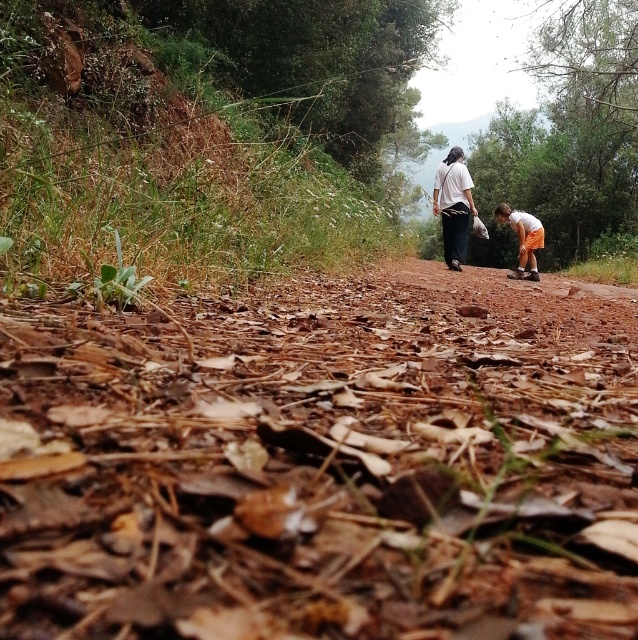
You are standing in a forest path and see the brown dry leaves at center and the orange cotton shorts at lower right. Which object is nearer to you?

The brown dry leaves at center are closer to the viewer than the orange cotton shorts at lower right.

You are a hiker planning to place a marker between the brown dry leaves at center and the white cotton shirt at upper center. How far apart should you place the markers to ensure they are exactly where these objects are located?

The markers should be placed 5.26 meters apart to accurately reflect the distance between the brown dry leaves at center and the white cotton shirt at upper center.